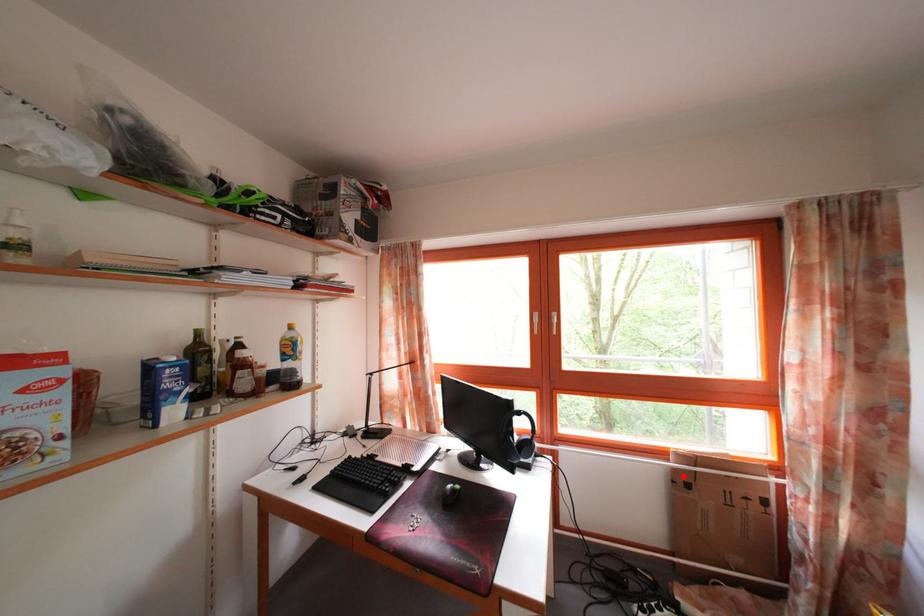
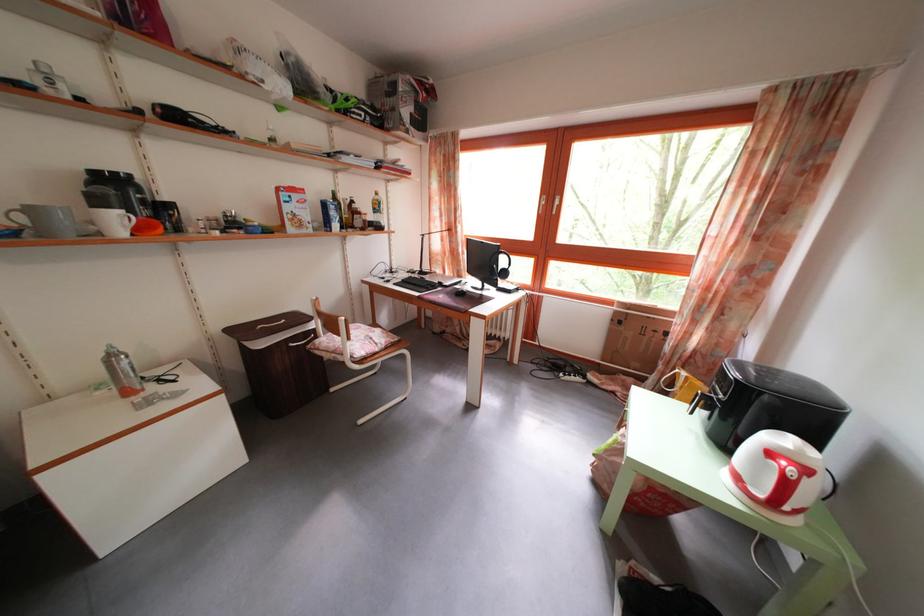
Where in the second image is the point corresponding to the highlighted location from the first image?

(623, 320)